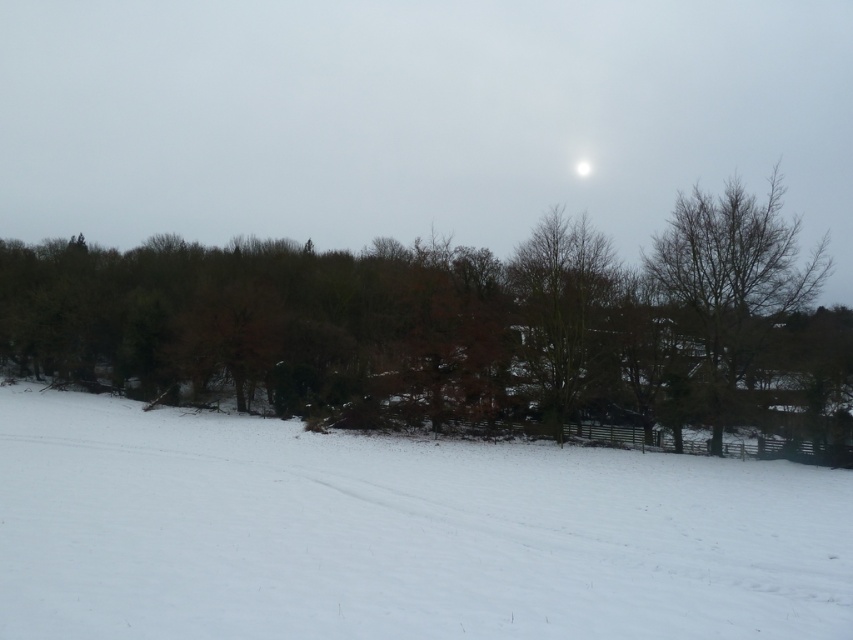
Is point (686, 291) positioned in front of point (514, 262)?

Yes, point (686, 291) is in front of point (514, 262).

Between bare branches at right and bare branches at center, which one has more height?

bare branches at right is taller.

Find the location of a particular element. The height and width of the screenshot is (640, 853). bare branches at right is located at coordinates (733, 278).

Who is lower down, white snow ski slope at lower center or brown leafy tree at center?

white snow ski slope at lower center is lower down.

Does white snow ski slope at lower center have a larger size compared to brown leafy tree at center?

Actually, white snow ski slope at lower center might be smaller than brown leafy tree at center.

Between point (108, 520) and point (683, 291), which one is positioned in front?

Positioned in front is point (108, 520).

Locate an element on the screen. white snow ski slope at lower center is located at coordinates (397, 532).

Measure the distance between point (775, 266) and camera.

Point (775, 266) is 50.93 meters from camera.

Between brown leafy tree at center and bare branches at center, which one is positioned lower?

bare branches at center is below.

Measure the distance between brown leafy tree at center and camera.

The distance of brown leafy tree at center from camera is 44.63 meters.

Locate an element on the screen. This screenshot has height=640, width=853. brown leafy tree at center is located at coordinates click(x=459, y=326).